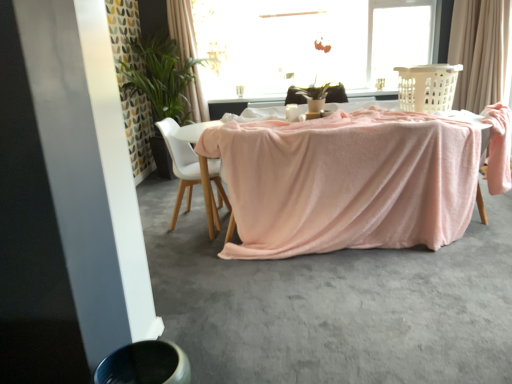
Measure the distance between pink fabric armchair at right and camera.

The depth of pink fabric armchair at right is 9.22 feet.

Describe the element at coordinates (344, 181) in the screenshot. I see `pink velvety table at center` at that location.

The height and width of the screenshot is (384, 512). In order to click on light beige fabric curtain at upper center, which is the first curtain from left to right in this screenshot , I will do `click(182, 27)`.

What do you see at coordinates (333, 304) in the screenshot? I see `smooth gray concrete at lower center` at bounding box center [333, 304].

The height and width of the screenshot is (384, 512). Find the location of `white matte chair at center`. white matte chair at center is located at coordinates (181, 161).

This screenshot has width=512, height=384. In order to click on pink fabric armchair at right in this screenshot , I will do `click(498, 148)`.

Considering the positions of points (180, 122) and (499, 68), is point (180, 122) closer to camera compared to point (499, 68)?

No.

Considering the positions of objects green leafy plant at upper left and beige fabric curtain at upper right, positioned as the 1th curtain in right-to-left order, in the image provided, who is in front, green leafy plant at upper left or beige fabric curtain at upper right, positioned as the 1th curtain in right-to-left order,?

green leafy plant at upper left is closer to the camera.

Based on the photo, which object is wider, green leafy plant at upper left or beige fabric curtain at upper right, positioned as the 1th curtain in right-to-left order?

green leafy plant at upper left is wider.

Looking at this image, from a real-world perspective, is green leafy plant at upper left on top of beige fabric curtain at upper right, the 2th curtain in the left-to-right sequence?

No, from a real-world perspective, green leafy plant at upper left is not over beige fabric curtain at upper right, the 2th curtain in the left-to-right sequence

Is pink velvety table at center facing away from light beige fabric curtain at upper center, which is the first curtain from left to right?

No, pink velvety table at center is not facing away from light beige fabric curtain at upper center, which is the first curtain from left to right.

Considering the points (302, 232) and (180, 7), which point is behind, point (302, 232) or point (180, 7)?

Point (180, 7)

Does pink velvety table at center have a larger size compared to light beige fabric curtain at upper center, which is the first curtain from left to right?

Yes, pink velvety table at center is bigger than light beige fabric curtain at upper center, which is the first curtain from left to right.

Can you tell me how much green leafy plant at upper left and pink velvety table at center differ in facing direction?

They differ by 1.32 degrees in their facing directions.

Does green leafy plant at upper left have a larger size compared to pink velvety table at center?

Actually, green leafy plant at upper left might be smaller than pink velvety table at center.

Is green leafy plant at upper left shorter than pink velvety table at center?

No.

Is green leafy plant at upper left positioned with its back to pink velvety table at center?

No, green leafy plant at upper left's orientation is not away from pink velvety table at center.

The width and height of the screenshot is (512, 384). In order to click on armchair located on the right of smooth gray concrete at lower center in this screenshot , I will do `click(498, 148)`.

How distant is pink fabric armchair at right from smooth gray concrete at lower center?

pink fabric armchair at right and smooth gray concrete at lower center are 1.06 meters apart.

Is pink fabric armchair at right at the right side of smooth gray concrete at lower center?

Yes, pink fabric armchair at right is to the right of smooth gray concrete at lower center.

In the scene shown: Considering their positions, is pink fabric armchair at right located in front of or behind smooth gray concrete at lower center?

Clearly, pink fabric armchair at right is behind smooth gray concrete at lower center.

From a real-world perspective, between white matte chair at center and transparent glass window at upper center, who is vertically lower?

white matte chair at center.

From the picture: Is transparent glass window at upper center at the back of white matte chair at center?

No, transparent glass window at upper center is not at the back of white matte chair at center.

From the image's perspective, which is below, light beige fabric curtain at upper center, the second curtain when ordered from right to left, or smooth gray concrete at lower center?

From the image's view, smooth gray concrete at lower center is below.

Between light beige fabric curtain at upper center, which is the first curtain from left to right, and smooth gray concrete at lower center, which one is positioned behind?

Positioned behind is light beige fabric curtain at upper center, which is the first curtain from left to right.

Looking at this image, considering the relative positions of light beige fabric curtain at upper center, which is the first curtain from left to right, and smooth gray concrete at lower center in the image provided, is light beige fabric curtain at upper center, which is the first curtain from left to right, to the right of smooth gray concrete at lower center from the viewer's perspective?

No, light beige fabric curtain at upper center, which is the first curtain from left to right, is not to the right of smooth gray concrete at lower center.

Which of these two, light beige fabric curtain at upper center, which is the first curtain from left to right, or smooth gray concrete at lower center, is wider?

smooth gray concrete at lower center.

Image resolution: width=512 pixels, height=384 pixels. I want to click on chair located underneath the beige plastic laundry basket at upper right (from a real-world perspective), so click(181, 161).

Between beige plastic laundry basket at upper right and white matte chair at center, which one appears on the right side from the viewer's perspective?

From the viewer's perspective, beige plastic laundry basket at upper right appears more on the right side.

Is beige plastic laundry basket at upper right oriented away from white matte chair at center?

No, white matte chair at center is not at the back of beige plastic laundry basket at upper right.

Where is `houseplant located below the beige fabric curtain at upper right, the 2th curtain in the left-to-right sequence (from the image's perspective)`? The image size is (512, 384). houseplant located below the beige fabric curtain at upper right, the 2th curtain in the left-to-right sequence (from the image's perspective) is located at coordinates [x=159, y=76].

Identify the location of table below the light beige fabric curtain at upper center, which is the first curtain from left to right (from a real-world perspective). (344, 181).

Looking at the image, which one is located closer to beige fabric curtain at upper right, the 2th curtain in the left-to-right sequence, beige plastic laundry basket at upper right or pink fabric armchair at right?

The object closer to beige fabric curtain at upper right, the 2th curtain in the left-to-right sequence, is beige plastic laundry basket at upper right.

Considering their positions, is light beige fabric curtain at upper center, the second curtain when ordered from right to left, positioned closer to pink velvety table at center than beige fabric curtain at upper right, the 2th curtain in the left-to-right sequence?

beige fabric curtain at upper right, the 2th curtain in the left-to-right sequence, lies closer to pink velvety table at center than the other object.

Estimate the real-world distances between objects in this image. Which object is further from transparent glass window at upper center, light beige fabric curtain at upper center, which is the first curtain from left to right, or white matte chair at center?

white matte chair at center is further to transparent glass window at upper center.

Considering their positions, is smooth gray concrete at lower center positioned further to white matte chair at center than transparent glass window at upper center?

Based on the image, transparent glass window at upper center appears to be further to white matte chair at center.

Looking at the image, which one is located closer to pink fabric armchair at right, smooth gray concrete at lower center or transparent glass window at upper center?

Among the two, smooth gray concrete at lower center is located nearer to pink fabric armchair at right.

When comparing their distances from transparent glass window at upper center, does pink fabric armchair at right or green leafy plant at upper left seem further?

The object further to transparent glass window at upper center is pink fabric armchair at right.

Which object lies nearer to the anchor point pink fabric armchair at right, beige plastic laundry basket at upper right or white matte chair at center?

beige plastic laundry basket at upper right.

Consider the image. From the image, which object appears to be nearer to light beige fabric curtain at upper center, the second curtain when ordered from right to left, pink velvety table at center or transparent glass window at upper center?

The object closer to light beige fabric curtain at upper center, the second curtain when ordered from right to left, is transparent glass window at upper center.

Locate an element on the screen. table between smooth gray concrete at lower center and beige fabric curtain at upper right, the 2th curtain in the left-to-right sequence, in the front-back direction is located at coordinates (344, 181).

I want to click on houseplant between smooth gray concrete at lower center and transparent glass window at upper center in the front-back direction, so click(159, 76).

What are the coordinates of `table located between smooth gray concrete at lower center and green leafy plant at upper left in the depth direction` in the screenshot? It's located at (344, 181).

Locate an element on the screen. This screenshot has height=384, width=512. table between white matte chair at center and beige fabric curtain at upper right, the 2th curtain in the left-to-right sequence, in the horizontal direction is located at coordinates (344, 181).